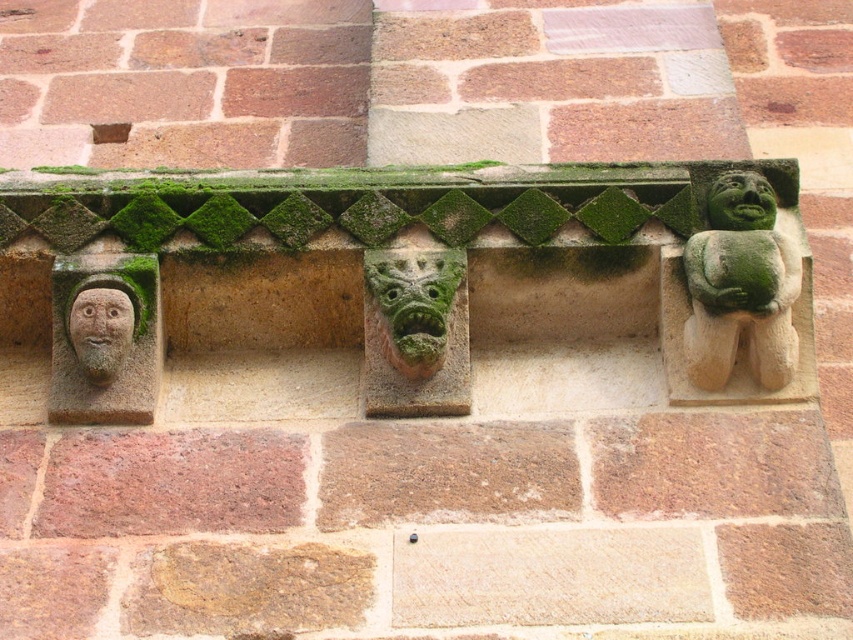
Question: Does green stone figure at right appear under green stone gargoyle at center?

Choices:
 (A) yes
 (B) no

Answer: (B)

Question: Is green stone figure at right further to the viewer compared to gray stone face at left?

Choices:
 (A) no
 (B) yes

Answer: (A)

Question: Among these points, which one is nearest to the camera?

Choices:
 (A) (73, 362)
 (B) (102, 374)
 (C) (665, 184)

Answer: (B)

Question: Which point appears closest to the camera in this image?

Choices:
 (A) (125, 333)
 (B) (83, 305)

Answer: (A)

Question: Which object is farther from the camera taking this photo?

Choices:
 (A) gray stone face at left
 (B) green stone figure at right
 (C) green stone gargoyle at center

Answer: (A)

Question: Can you confirm if green mossy stone ledge at upper center is positioned above green stone face at upper right?

Choices:
 (A) no
 (B) yes

Answer: (B)